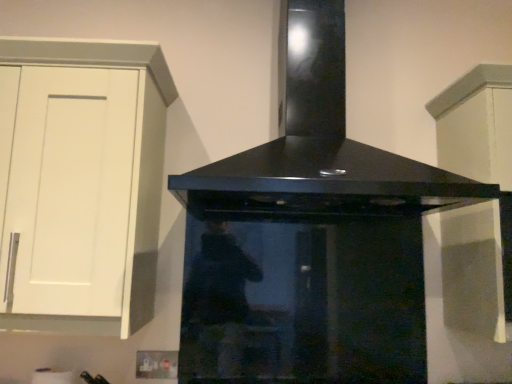
Question: From the image's perspective, would you say white matte cabinet at upper right, the 1th cabinetry viewed from the right, is positioned over white matte cabinet at left, arranged as the first cabinetry when viewed from the left?

Choices:
 (A) no
 (B) yes

Answer: (A)

Question: Considering the relative sizes of white matte cabinet at upper right, the 1th cabinetry viewed from the right, and white matte cabinet at left, placed as the second cabinetry when sorted from right to left, in the image provided, is white matte cabinet at upper right, the 1th cabinetry viewed from the right, bigger than white matte cabinet at left, placed as the second cabinetry when sorted from right to left,?

Choices:
 (A) no
 (B) yes

Answer: (A)

Question: Does white matte cabinet at upper right, the 1th cabinetry viewed from the right, appear on the right side of white matte cabinet at left, placed as the second cabinetry when sorted from right to left?

Choices:
 (A) no
 (B) yes

Answer: (B)

Question: Does white matte cabinet at upper right, the 1th cabinetry viewed from the right, come behind white matte cabinet at left, placed as the second cabinetry when sorted from right to left?

Choices:
 (A) yes
 (B) no

Answer: (A)

Question: Considering the relative sizes of white matte cabinet at upper right, the 1th cabinetry viewed from the right, and white matte cabinet at left, arranged as the first cabinetry when viewed from the left, in the image provided, is white matte cabinet at upper right, the 1th cabinetry viewed from the right, smaller than white matte cabinet at left, arranged as the first cabinetry when viewed from the left,?

Choices:
 (A) yes
 (B) no

Answer: (A)

Question: Is white matte cabinet at upper right, the 1th cabinetry viewed from the right, completely or partially outside of white matte cabinet at left, placed as the second cabinetry when sorted from right to left?

Choices:
 (A) yes
 (B) no

Answer: (A)

Question: Can you confirm if white matte cabinet at left, arranged as the first cabinetry when viewed from the left, is shorter than black glossy range hood at center?

Choices:
 (A) yes
 (B) no

Answer: (A)

Question: Is white matte cabinet at left, arranged as the first cabinetry when viewed from the left, outside of black glossy range hood at center?

Choices:
 (A) yes
 (B) no

Answer: (A)

Question: Considering the relative sizes of white matte cabinet at left, placed as the second cabinetry when sorted from right to left, and black glossy range hood at center in the image provided, is white matte cabinet at left, placed as the second cabinetry when sorted from right to left, bigger than black glossy range hood at center?

Choices:
 (A) yes
 (B) no

Answer: (B)

Question: Is the depth of white matte cabinet at left, arranged as the first cabinetry when viewed from the left, less than that of black glossy range hood at center?

Choices:
 (A) yes
 (B) no

Answer: (B)

Question: From the image's perspective, would you say white matte cabinet at left, placed as the second cabinetry when sorted from right to left, is positioned over black glossy range hood at center?

Choices:
 (A) no
 (B) yes

Answer: (A)

Question: Does white matte cabinet at left, placed as the second cabinetry when sorted from right to left, have a greater height compared to black glossy range hood at center?

Choices:
 (A) no
 (B) yes

Answer: (A)

Question: Can you confirm if black glossy range hood at center is wider than white matte cabinet at upper right, which is counted as the second cabinetry, starting from the left?

Choices:
 (A) no
 (B) yes

Answer: (B)